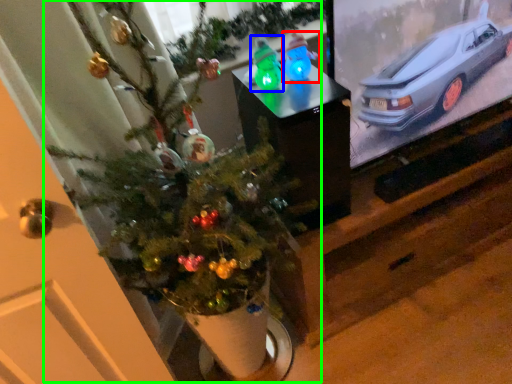
Question: Which is farther away from toy (highlighted by a red box)? toy (highlighted by a blue box) or christmas tree (highlighted by a green box)?

Choices:
 (A) toy
 (B) christmas tree

Answer: (B)